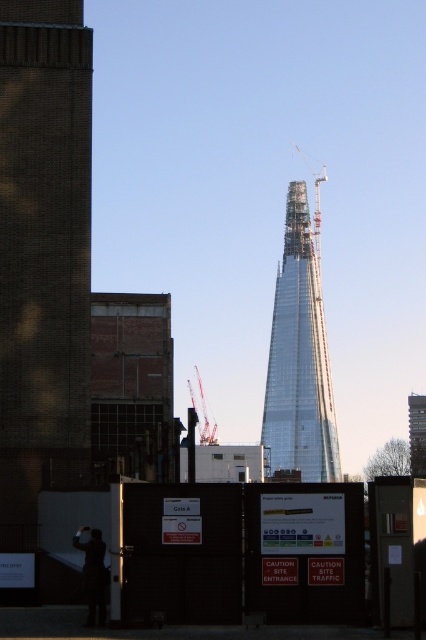
You are a delivery driver approaching the construction site. You see the brick wall at left and the dark matte jacket at lower left. Which object is positioned higher from the ground?

The brick wall at left is above dark matte jacket at lower left, so the brick wall at left is higher from the ground.

You are standing at the construction site fence and want to determine the relative positions of two points marked on the ground. Which point is closer to you, point (282,362) or point (198,376)?

Point (282,362) is closer to the viewer than point (198,376).

You are standing at the entrance of the construction site marked by Gate A. From your current position, in which direction should you look to see the glassy steel tower at center?

The glassy steel tower at center is located at point coordinates that are to the north of your position at Gate A. Therefore, you should look north to see it.